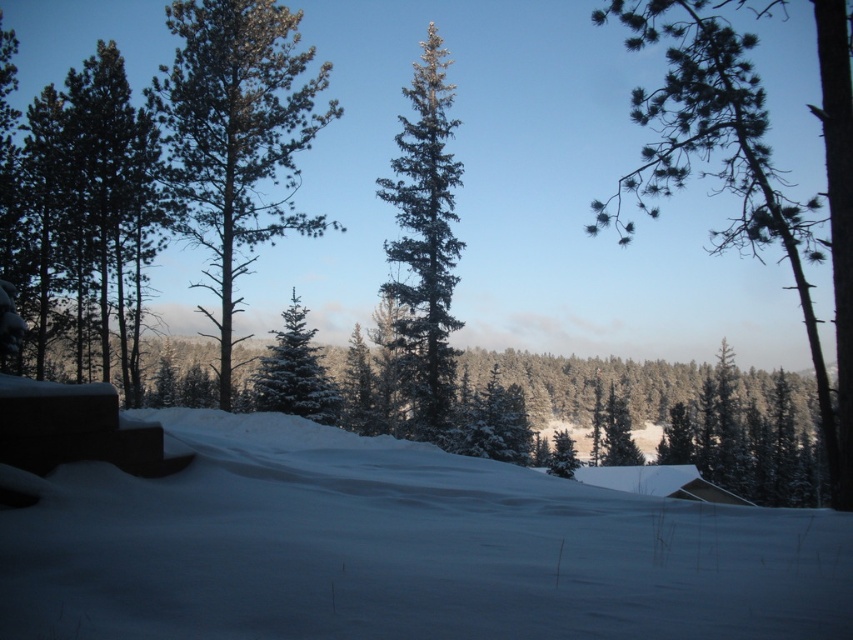
The height and width of the screenshot is (640, 853). Describe the element at coordinates (84, 218) in the screenshot. I see `green matte tree at left` at that location.

Does green matte tree at left appear under green needle-like at upper right?

Indeed, green matte tree at left is positioned under green needle-like at upper right.

Locate an element on the screen. This screenshot has width=853, height=640. green matte tree at left is located at coordinates (84, 218).

Image resolution: width=853 pixels, height=640 pixels. Describe the element at coordinates (424, 244) in the screenshot. I see `green textured pine tree at center` at that location.

Is point (451, 392) closer to viewer compared to point (273, 410)?

No, (451, 392) is behind (273, 410).

What do you see at coordinates (424, 244) in the screenshot? The image size is (853, 640). I see `green textured pine tree at center` at bounding box center [424, 244].

In order to click on green textured pine tree at center in this screenshot , I will do `click(424, 244)`.

Does green needle-like at upper right have a lesser height compared to green textured pine tree at center?

In fact, green needle-like at upper right may be taller than green textured pine tree at center.

This screenshot has height=640, width=853. Identify the location of green needle-like at upper right. (749, 164).

Is point (682, 173) more distant than point (390, 285)?

No, it is not.

Identify the location of green needle-like at upper right. (749, 164).